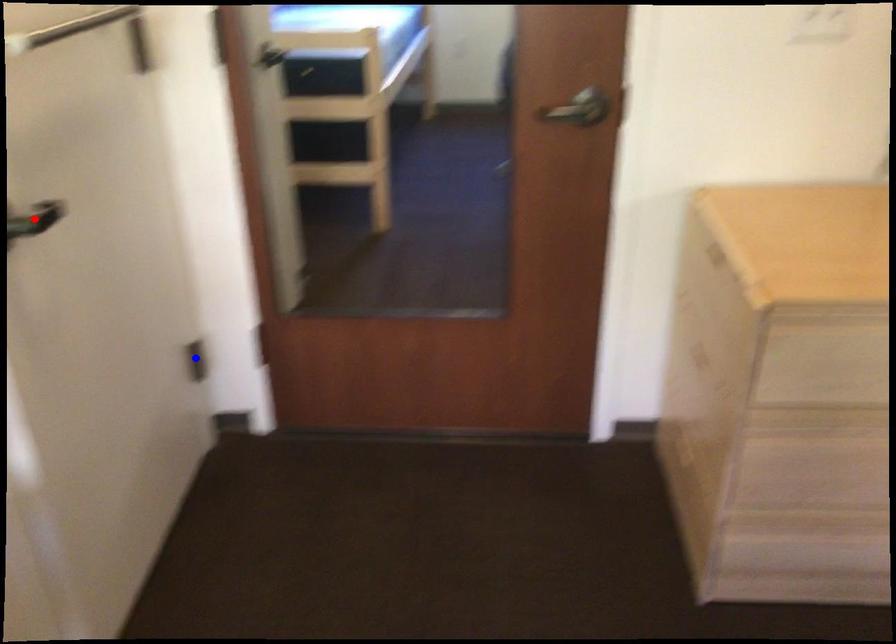
Question: Two points are marked on the image. Which point is closer to the camera?

Choices:
 (A) Blue point is closer.
 (B) Red point is closer.

Answer: (B)